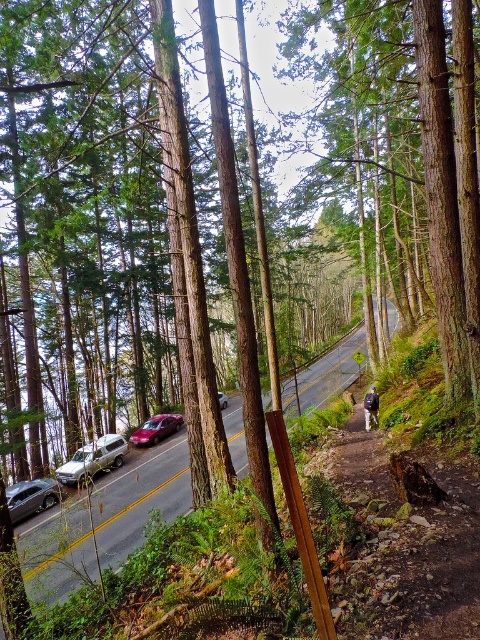
Which is in front, point (374, 387) or point (224, 401)?

Point (374, 387) is in front.

Locate an element on the screen. This screenshot has height=640, width=480. dark blue backpack at lower right is located at coordinates (371, 406).

This screenshot has width=480, height=640. Describe the element at coordinates (371, 406) in the screenshot. I see `dark blue backpack at lower right` at that location.

Image resolution: width=480 pixels, height=640 pixels. What are the coordinates of `dark blue backpack at lower right` in the screenshot? It's located at (371, 406).

Is shiny silver sedan at lower left thinner than metallic red sedan at center-left?

Indeed, shiny silver sedan at lower left has a lesser width compared to metallic red sedan at center-left.

Which is behind, point (48, 484) or point (163, 435)?

Positioned behind is point (163, 435).

Between point (57, 500) and point (156, 426), which one is positioned behind?

Point (156, 426)

Find the location of a particular element. shiny silver sedan at lower left is located at coordinates (31, 497).

Between point (6, 493) and point (364, 410), which one is positioned behind?

The point (6, 493) is more distant.

In the scene shown: Is shiny silver sedan at lower left shorter than dark blue backpack at lower right?

Correct, shiny silver sedan at lower left is not as tall as dark blue backpack at lower right.

Is point (11, 497) closer to camera compared to point (374, 406)?

No, it is behind (374, 406).

You are a GUI agent. You are given a task and a screenshot of the screen. Output one action in this format:
    pyautogui.click(x=<x>, y=<y>)
    Task: Click on the shiny silver sedan at lower left
    
    Given the screenshot: What is the action you would take?
    pos(31,497)